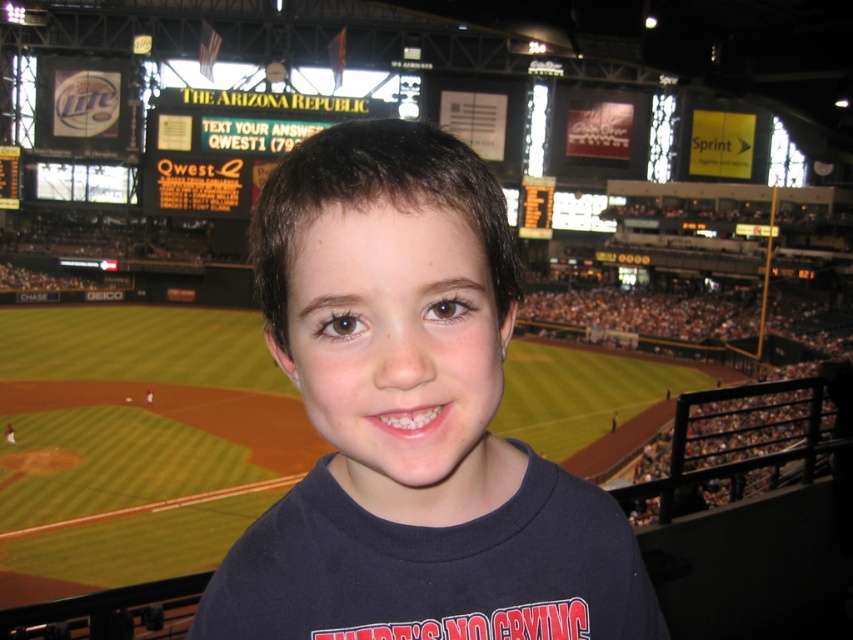
Is point (397, 264) closer to camera compared to point (155, 166)?

Yes, it is.

Does dark blue t-shirt at center come behind yellow digital scoreboard at upper center?

That is False.

In order to click on dark blue t-shirt at center in this screenshot , I will do `click(410, 419)`.